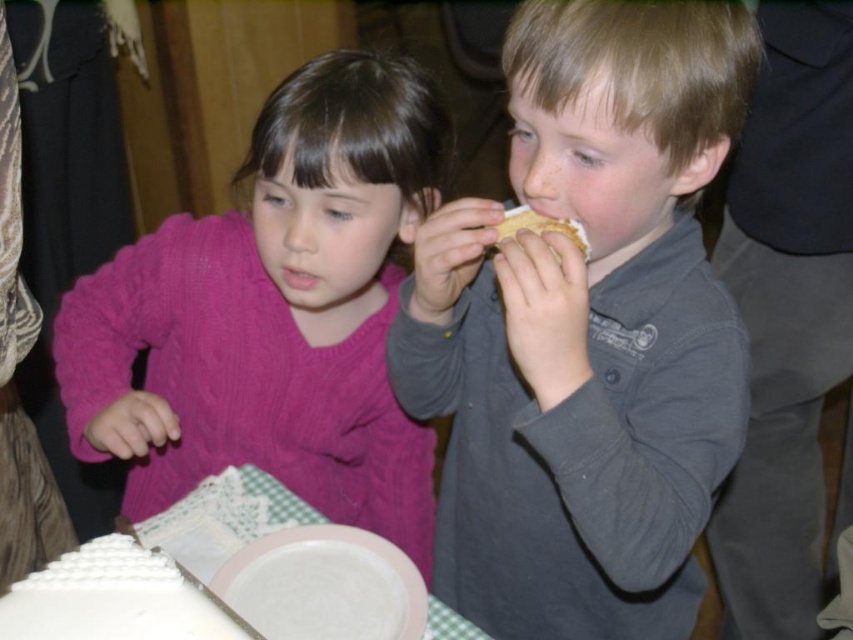
Between pink knitted sweater at left and golden crumbly pie at upper center, which one has less height?

golden crumbly pie at upper center

Who is positioned more to the right, pink knitted sweater at left or golden crumbly pie at upper center?

From the viewer's perspective, golden crumbly pie at upper center appears more on the right side.

Is point (357, 56) farther from camera compared to point (583, 241)?

Yes, point (357, 56) is behind point (583, 241).

This screenshot has height=640, width=853. What are the coordinates of `pink knitted sweater at left` in the screenshot? It's located at (273, 314).

Does white frosted cake at lower left have a lesser height compared to golden crumbly pie at upper center?

Incorrect, white frosted cake at lower left's height does not fall short of golden crumbly pie at upper center's.

Which is in front, point (224, 560) or point (526, 208)?

Point (526, 208) is more forward.

Identify the location of white frosted cake at lower left. (223, 518).

In the scene shown: Can you confirm if matte gray shirt at center is positioned above white smooth cake at lower left?

Yes.

Can you confirm if matte gray shirt at center is wider than white smooth cake at lower left?

Indeed, matte gray shirt at center has a greater width compared to white smooth cake at lower left.

Which is in front, point (404, 317) or point (90, 636)?

Point (90, 636) is in front.

At what (x,y) coordinates should I click in order to perform the action: click on matte gray shirt at center. Please return your answer as a coordinate pair (x, y). Looking at the image, I should click on (585, 330).